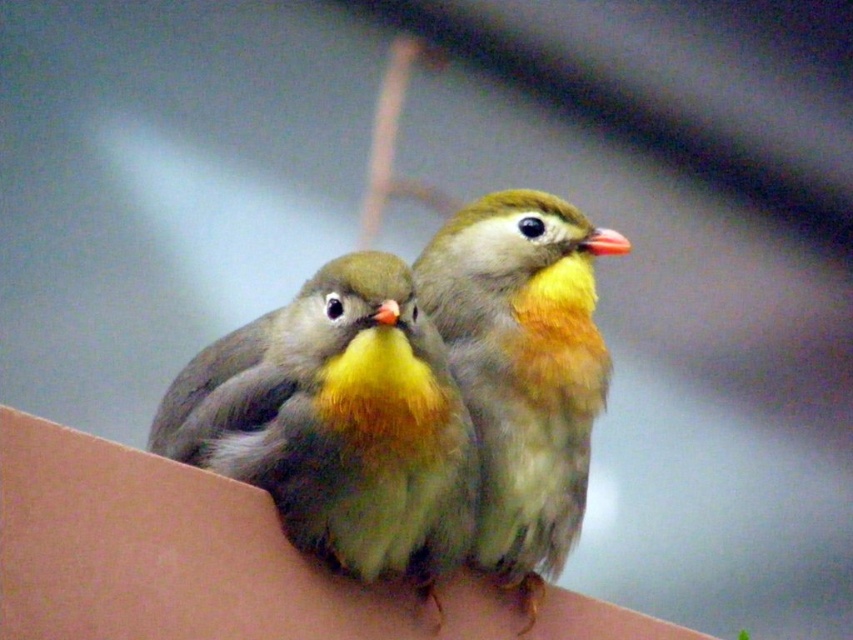
Between soft yellow feathers at center and soft yellow-green feathers at center, which one appears on the left side from the viewer's perspective?

Positioned to the left is soft yellow feathers at center.

Which is in front, point (308, 396) or point (589, 301)?

Point (308, 396)

In order to click on soft yellow feathers at center in this screenshot , I will do `click(338, 422)`.